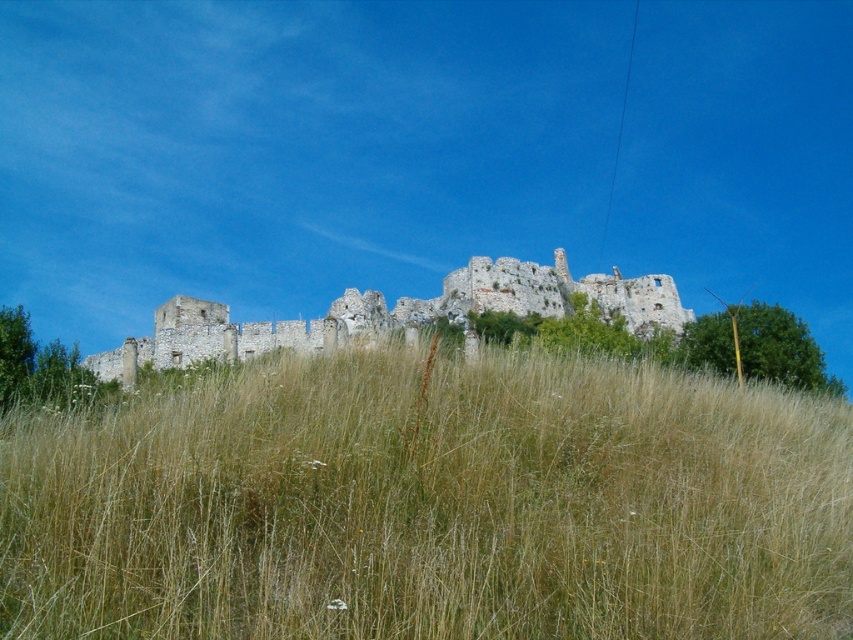
Question: Can you confirm if brown dry grass at center is wider than weathered stone ruins at center?

Choices:
 (A) yes
 (B) no

Answer: (B)

Question: Among these objects, which one is nearest to the camera?

Choices:
 (A) brown dry grass at center
 (B) weathered stone ruins at center

Answer: (A)

Question: Which point is closer to the camera?

Choices:
 (A) (527, 280)
 (B) (590, 618)

Answer: (B)

Question: Considering the relative positions of brown dry grass at center and weathered stone ruins at center in the image provided, where is brown dry grass at center located with respect to weathered stone ruins at center?

Choices:
 (A) left
 (B) right

Answer: (A)

Question: Is brown dry grass at center smaller than weathered stone ruins at center?

Choices:
 (A) yes
 (B) no

Answer: (A)